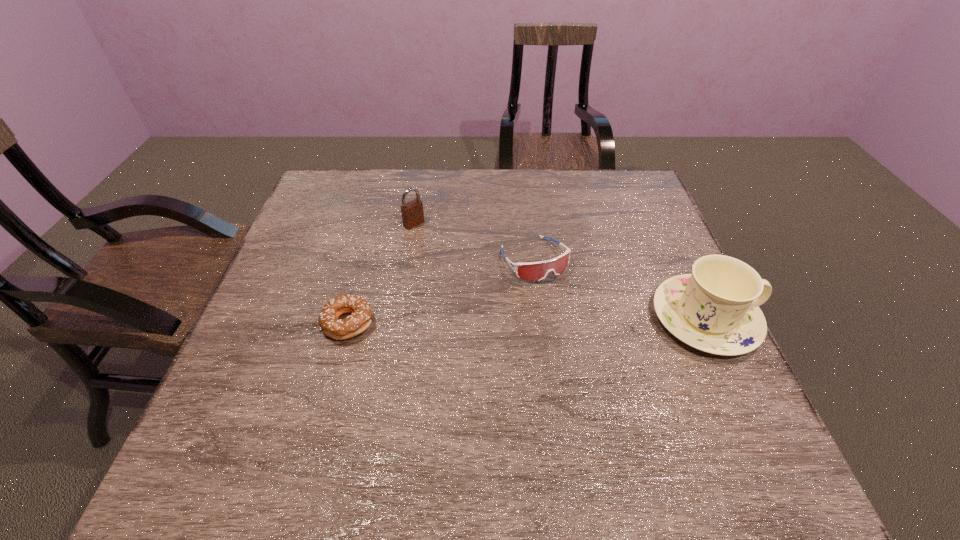
At what (x,y) coordinates should I click in order to perform the action: click on free space on the desktop that is between the leftmost object and the rightmost object and is positioned on the front-facing side of the farthest object. Please return your answer as a coordinate pair (x, y). The width and height of the screenshot is (960, 540). Looking at the image, I should click on (536, 321).

The height and width of the screenshot is (540, 960). I want to click on free space on the desktop that is between the doughnut and the chinaware and is positioned on the front-facing side of the second shortest object, so click(577, 320).